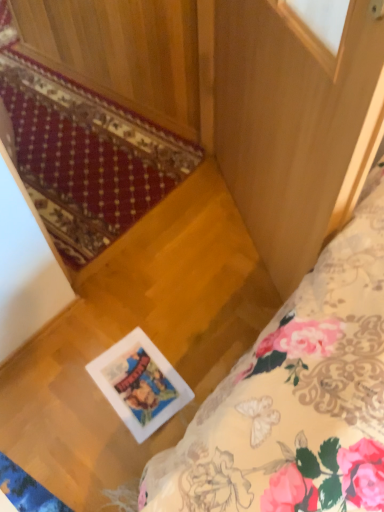
Find the location of a particular element. Image resolution: width=384 pixels, height=512 pixels. vacant area in front of wooden screen door at center is located at coordinates (203, 328).